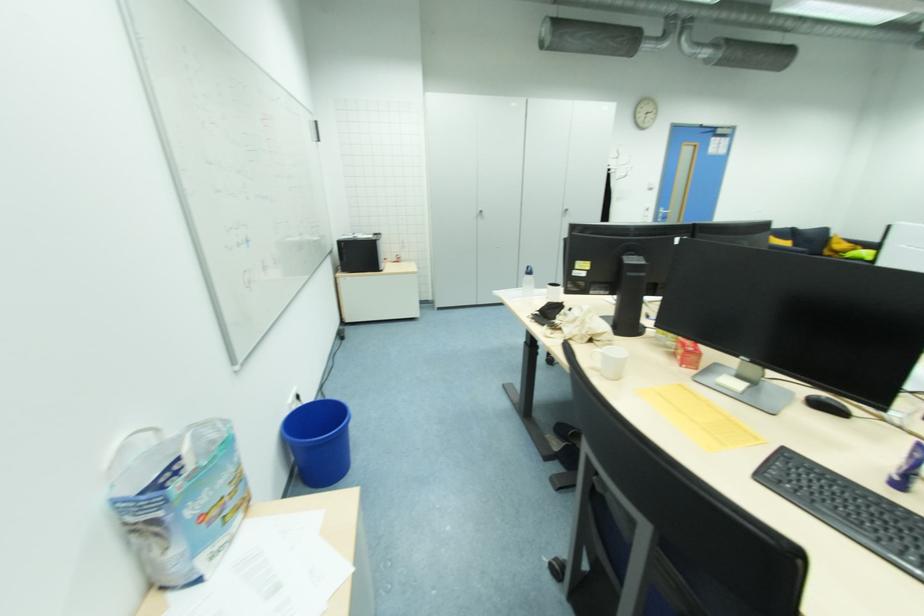
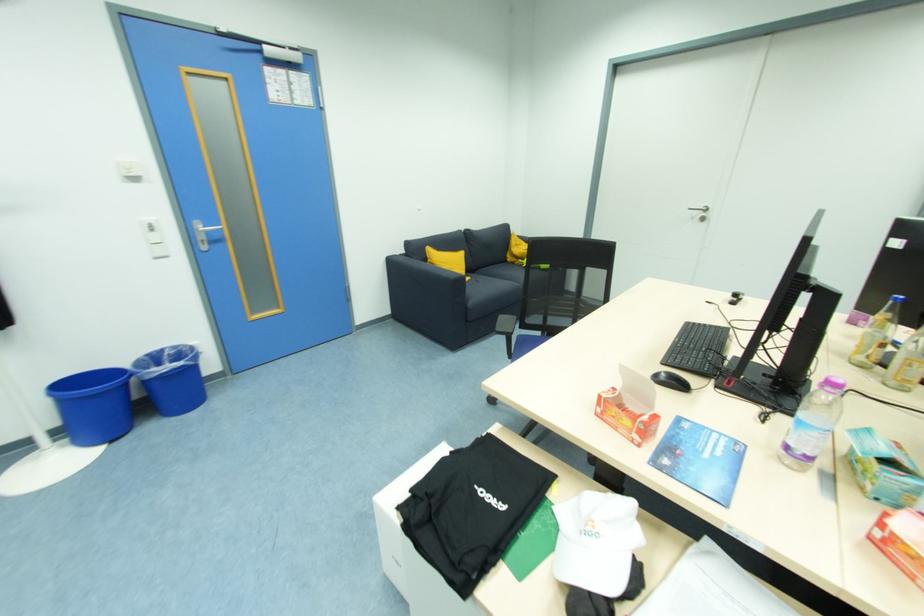
Where in the second image is the point corresponding to (x=831, y=257) from the first image?

(516, 265)